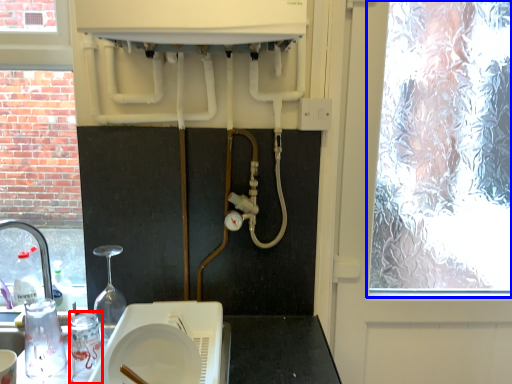
Question: Which object is closer to the camera taking this photo, appliance (highlighted by a red box) or window (highlighted by a blue box)?

Choices:
 (A) appliance
 (B) window

Answer: (A)